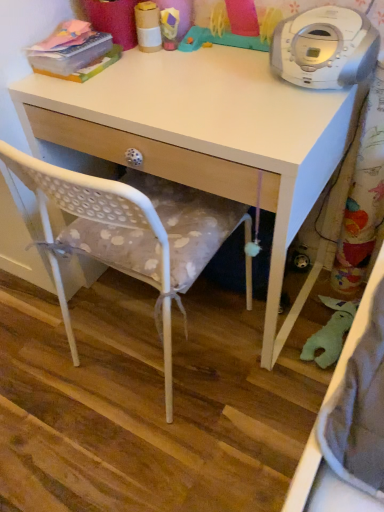
I want to click on vacant space to the left of white polka dot fabric chair at center, so click(48, 356).